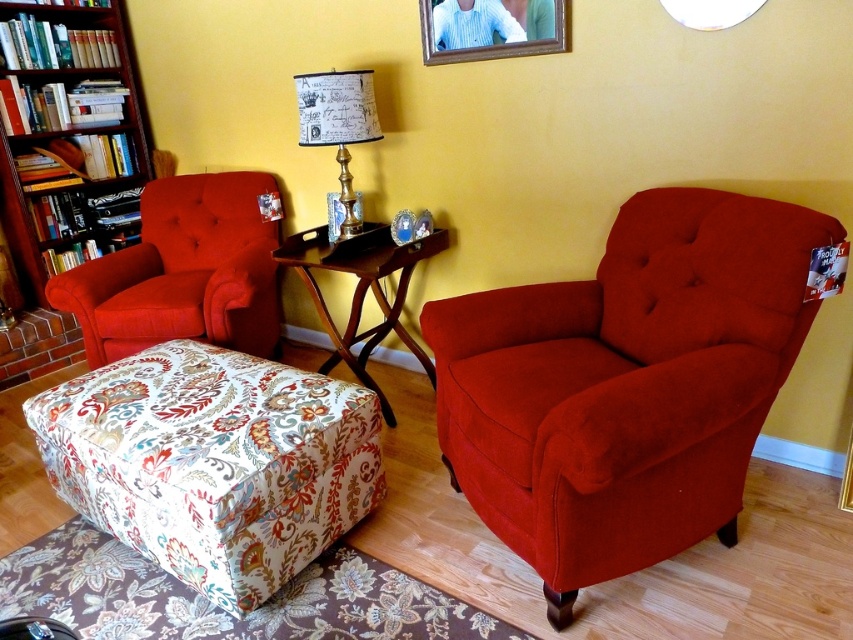
You are standing in the room and notice two points marked on the floor. The first point is at coordinates point (463, 29) and the second is at point (341, 108). If you want to walk from the first point to the second, which direction should you move relative to the room?

Point (463, 29) is behind point (341, 108), so to move from the first point to the second, you should move forward towards the front of the room.

You are arranging items on a table and need to know which object takes up more horizontal space. Which is wider between the wooden picture frame at upper center and the gold metallic lampshade at upper center?

The wooden picture frame at upper center is wider than the gold metallic lampshade at upper center.

You are moving a large painting that is 1.2 meters wide. You want to place it on either the wooden bookshelf at left or the wooden picture frame at upper center. Which one can accommodate the painting based on their sizes?

The wooden bookshelf at left is larger in size than the wooden picture frame at upper center, so the painting can be placed on the wooden bookshelf at left.